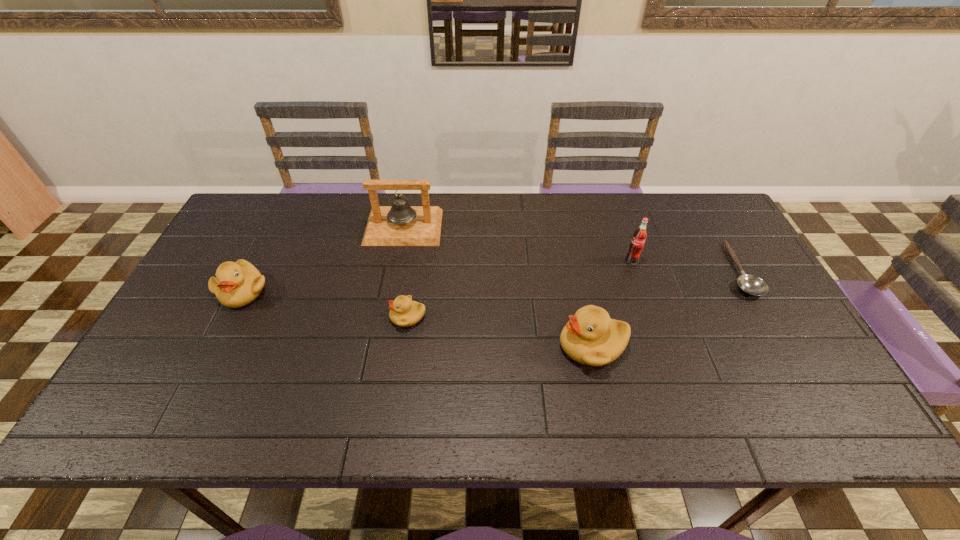
Identify the location of vacant space that is in between the bell and the leftmost duckling. (324, 259).

Find the location of a particular element. empty space that is in between the bell and the leftmost duckling is located at coordinates (324, 259).

Image resolution: width=960 pixels, height=540 pixels. Find the location of `free area in between the fifth tallest object and the shortest object`. free area in between the fifth tallest object and the shortest object is located at coordinates (573, 293).

Locate an element on the screen. This screenshot has height=540, width=960. empty space between the bell and the shortest duckling is located at coordinates (406, 272).

This screenshot has height=540, width=960. Find the location of `free point between the soda bottle and the rightmost object`. free point between the soda bottle and the rightmost object is located at coordinates (684, 265).

The image size is (960, 540). I want to click on free space that is in between the fourth tallest object and the fifth object from left to right, so tap(438, 276).

I want to click on free space that is in between the bell and the ladle, so click(x=570, y=248).

Identify the location of free spot between the fourth tallest object and the second duckling from right to left. (325, 304).

Find the location of a particular element. The height and width of the screenshot is (540, 960). the fifth closest object to the second object from right to left is located at coordinates (236, 284).

Image resolution: width=960 pixels, height=540 pixels. I want to click on object that stands as the closest to the shortest object, so click(637, 243).